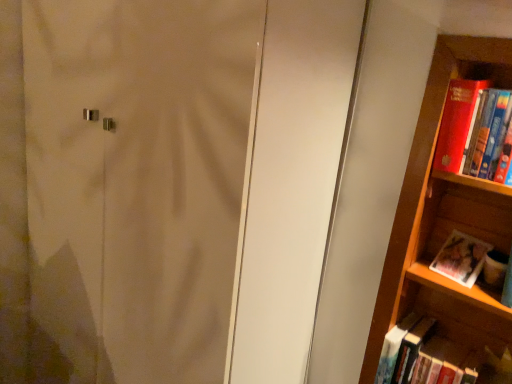
In order to face red matte book at right, which is the 1th book from top to bottom, should I rotate leftwards or rightwards?

A 28.512 degree turn to the right will do.

In order to face hardcover book at lower right, positioned as the third book in top-to-bottom order, should I rotate leftwards or rightwards?

You should look right and rotate roughly 24.962 degrees.

Locate an element on the screen. The image size is (512, 384). matte white screen door at center is located at coordinates [137, 180].

At what (x,y) coordinates should I click in order to perform the action: click on screen door below the red matte book at right, which is the 1th book from top to bottom (from the image's perspective). Please return your answer as a coordinate pair (x, y). Looking at the image, I should click on (137, 180).

From the image's perspective, is red matte book at right, which is the 1th book from top to bottom, over matte white screen door at center?

Yes, from the image's perspective, red matte book at right, which is the 1th book from top to bottom, is on top of matte white screen door at center.

Is red matte book at right, which is counted as the 3th book, starting from the bottom, facing away from matte white screen door at center?

red matte book at right, which is counted as the 3th book, starting from the bottom, is not turned away from matte white screen door at center.

From a real-world perspective, is red matte book at right, which is counted as the 3th book, starting from the bottom, positioned above or below matte white screen door at center?

red matte book at right, which is counted as the 3th book, starting from the bottom, is situated higher than matte white screen door at center in the real world.

Between red matte book at right, which is counted as the 3th book, starting from the bottom, and matte paper photo album at right, which ranks as the second book in top-to-bottom order, which one has smaller size?

Smaller between the two is matte paper photo album at right, which ranks as the second book in top-to-bottom order.

Is red matte book at right, which is counted as the 3th book, starting from the bottom, at the left side of matte paper photo album at right, which ranks as the second book in top-to-bottom order?

Incorrect, red matte book at right, which is counted as the 3th book, starting from the bottom, is not on the left side of matte paper photo album at right, which ranks as the second book in top-to-bottom order.

Can you confirm if matte paper photo album at right, which ranks as the 2th book in bottom-to-top order, is thinner than red matte book at right, which is the 1th book from top to bottom?

Yes.

Does point (474, 267) appear closer or farther from the camera than point (474, 129)?

Point (474, 267) appears to be farther away from the viewer than point (474, 129).

Considering the relative sizes of matte paper photo album at right, which ranks as the 2th book in bottom-to-top order, and red matte book at right, which is counted as the 3th book, starting from the bottom, in the image provided, is matte paper photo album at right, which ranks as the 2th book in bottom-to-top order, bigger than red matte book at right, which is counted as the 3th book, starting from the bottom,?

Actually, matte paper photo album at right, which ranks as the 2th book in bottom-to-top order, might be smaller than red matte book at right, which is counted as the 3th book, starting from the bottom.

Is the surface of matte paper photo album at right, which ranks as the 2th book in bottom-to-top order, in direct contact with red matte book at right, which is counted as the 3th book, starting from the bottom?

They are not placed beside each other.

Considering the relative sizes of matte paper photo album at right, which ranks as the second book in top-to-bottom order, and matte white screen door at center in the image provided, is matte paper photo album at right, which ranks as the second book in top-to-bottom order, smaller than matte white screen door at center?

Yes.

Which of these two, matte paper photo album at right, which ranks as the 2th book in bottom-to-top order, or matte white screen door at center, stands shorter?

matte paper photo album at right, which ranks as the 2th book in bottom-to-top order.

Is the position of matte paper photo album at right, which ranks as the 2th book in bottom-to-top order, more distant than that of matte white screen door at center?

Yes, the depth of matte paper photo album at right, which ranks as the 2th book in bottom-to-top order, is greater than that of matte white screen door at center.

Would you say hardcover book at lower right, positioned as the first book in bottom-to-top order, is a long distance from matte paper photo album at right, which ranks as the 2th book in bottom-to-top order?

hardcover book at lower right, positioned as the first book in bottom-to-top order, is near matte paper photo album at right, which ranks as the 2th book in bottom-to-top order, not far away.

Visually, is hardcover book at lower right, positioned as the third book in top-to-bottom order, positioned to the left or to the right of matte paper photo album at right, which ranks as the second book in top-to-bottom order?

Based on their positions, hardcover book at lower right, positioned as the third book in top-to-bottom order, is located to the left of matte paper photo album at right, which ranks as the second book in top-to-bottom order.

Can you tell me how much hardcover book at lower right, positioned as the first book in bottom-to-top order, and matte paper photo album at right, which ranks as the second book in top-to-bottom order, differ in facing direction?

hardcover book at lower right, positioned as the first book in bottom-to-top order, and matte paper photo album at right, which ranks as the second book in top-to-bottom order, are facing 0.00168 degrees away from each other.

How far apart are hardcover book at lower right, positioned as the first book in bottom-to-top order, and matte paper photo album at right, which ranks as the second book in top-to-bottom order?

hardcover book at lower right, positioned as the first book in bottom-to-top order, and matte paper photo album at right, which ranks as the second book in top-to-bottom order, are 9.32 inches apart from each other.

From the image's perspective, would you say matte white screen door at center is shown under matte paper photo album at right, which ranks as the second book in top-to-bottom order?

Yes, from the image's perspective, matte white screen door at center is beneath matte paper photo album at right, which ranks as the second book in top-to-bottom order.

Considering the sizes of objects matte white screen door at center and matte paper photo album at right, which ranks as the second book in top-to-bottom order, in the image provided, who is shorter, matte white screen door at center or matte paper photo album at right, which ranks as the second book in top-to-bottom order,?

matte paper photo album at right, which ranks as the second book in top-to-bottom order.

Considering the relative positions of matte white screen door at center and matte paper photo album at right, which ranks as the second book in top-to-bottom order, in the image provided, is matte white screen door at center to the right of matte paper photo album at right, which ranks as the second book in top-to-bottom order, from the viewer's perspective?

In fact, matte white screen door at center is to the left of matte paper photo album at right, which ranks as the second book in top-to-bottom order.

Identify the location of the 1st book above when counting from the matte white screen door at center (from the image's perspective). Image resolution: width=512 pixels, height=384 pixels. (461, 258).

From the picture: Considering the relative positions of hardcover book at lower right, positioned as the third book in top-to-bottom order, and red matte book at right, which is the 1th book from top to bottom, in the image provided, is hardcover book at lower right, positioned as the third book in top-to-bottom order, to the left of red matte book at right, which is the 1th book from top to bottom, from the viewer's perspective?

Indeed, hardcover book at lower right, positioned as the third book in top-to-bottom order, is positioned on the left side of red matte book at right, which is the 1th book from top to bottom.

Is hardcover book at lower right, positioned as the third book in top-to-bottom order, touching red matte book at right, which is counted as the 3th book, starting from the bottom?

No, hardcover book at lower right, positioned as the third book in top-to-bottom order, is not beside red matte book at right, which is counted as the 3th book, starting from the bottom.

Can we say hardcover book at lower right, positioned as the first book in bottom-to-top order, lies outside red matte book at right, which is the 1th book from top to bottom?

That's correct, hardcover book at lower right, positioned as the first book in bottom-to-top order, is outside of red matte book at right, which is the 1th book from top to bottom.

From the image's perspective, who appears lower, hardcover book at lower right, positioned as the third book in top-to-bottom order, or red matte book at right, which is counted as the 3th book, starting from the bottom?

hardcover book at lower right, positioned as the third book in top-to-bottom order, from the image's perspective.

This screenshot has width=512, height=384. I want to click on screen door below the red matte book at right, which is the 1th book from top to bottom (from a real-world perspective), so click(137, 180).

This screenshot has width=512, height=384. Find the location of `book that is on the right side of matte paper photo album at right, which ranks as the 2th book in bottom-to-top order`. book that is on the right side of matte paper photo album at right, which ranks as the 2th book in bottom-to-top order is located at coordinates (469, 126).

Based on their spatial positions, is matte white screen door at center or hardcover book at lower right, positioned as the third book in top-to-bottom order, closer to red matte book at right, which is counted as the 3th book, starting from the bottom?

hardcover book at lower right, positioned as the third book in top-to-bottom order, is closer to red matte book at right, which is counted as the 3th book, starting from the bottom.

Estimate the real-world distances between objects in this image. Which object is closer to matte paper photo album at right, which ranks as the second book in top-to-bottom order, matte white screen door at center or hardcover book at lower right, positioned as the first book in bottom-to-top order?

hardcover book at lower right, positioned as the first book in bottom-to-top order.

From the picture: Which object lies further to the anchor point red matte book at right, which is the 1th book from top to bottom, matte paper photo album at right, which ranks as the second book in top-to-bottom order, or matte white screen door at center?

Among the two, matte white screen door at center is located further to red matte book at right, which is the 1th book from top to bottom.

Looking at the image, which one is located further to matte white screen door at center, hardcover book at lower right, positioned as the third book in top-to-bottom order, or red matte book at right, which is the 1th book from top to bottom?

hardcover book at lower right, positioned as the third book in top-to-bottom order, is positioned further to the anchor matte white screen door at center.

Looking at the image, which one is located closer to matte paper photo album at right, which ranks as the 2th book in bottom-to-top order, hardcover book at lower right, positioned as the first book in bottom-to-top order, or matte white screen door at center?

Among the two, hardcover book at lower right, positioned as the first book in bottom-to-top order, is located nearer to matte paper photo album at right, which ranks as the 2th book in bottom-to-top order.

Which object lies nearer to the anchor point hardcover book at lower right, positioned as the third book in top-to-bottom order, red matte book at right, which is counted as the 3th book, starting from the bottom, or matte white screen door at center?

red matte book at right, which is counted as the 3th book, starting from the bottom.

When comparing their distances from hardcover book at lower right, positioned as the third book in top-to-bottom order, does matte paper photo album at right, which ranks as the second book in top-to-bottom order, or matte white screen door at center seem further?

The object further to hardcover book at lower right, positioned as the third book in top-to-bottom order, is matte white screen door at center.

Consider the image. Which object lies further to the anchor point hardcover book at lower right, positioned as the first book in bottom-to-top order, matte white screen door at center or red matte book at right, which is counted as the 3th book, starting from the bottom?

Among the two, matte white screen door at center is located further to hardcover book at lower right, positioned as the first book in bottom-to-top order.

Locate an element on the screen. This screenshot has height=384, width=512. book situated between matte white screen door at center and matte paper photo album at right, which ranks as the 2th book in bottom-to-top order, from left to right is located at coordinates (435, 357).

Find the location of a particular element. This screenshot has height=384, width=512. book that lies between red matte book at right, which is counted as the 3th book, starting from the bottom, and hardcover book at lower right, positioned as the first book in bottom-to-top order, from top to bottom is located at coordinates (461, 258).